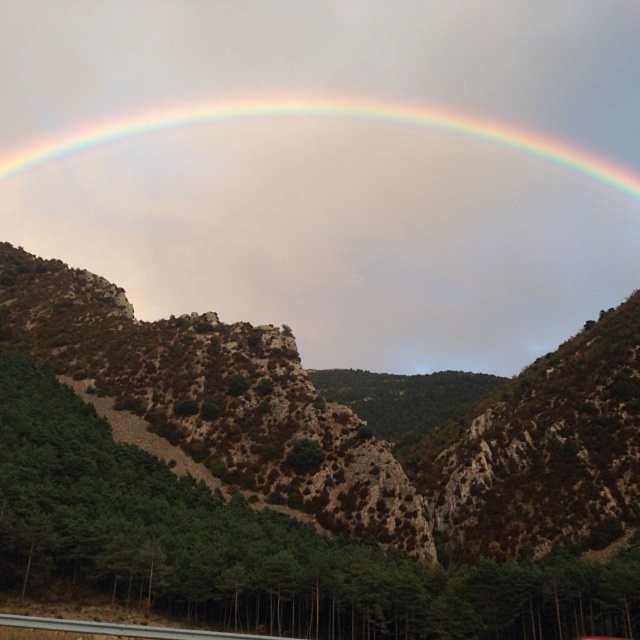
You are a photographer trying to capture the rainbow at upper center and the gray concrete highway at lower center in a single shot. Considering their positions and heights, can you frame the shot so both are visible without moving the camera?

The rainbow at upper center has a greater height compared to the gray concrete highway at lower center, so yes, you can frame the shot to include both as the rainbow is taller and positioned above the highway.

You are an astronomer analyzing the image. You need to determine the position of the rainbow at upper center. What are its coordinates?

The rainbow at upper center is located at coordinates (314, 115).

You are a photographer trying to capture the rainbow at upper center and the gray concrete highway at lower center in a single shot. Given their sizes, which object will appear bigger in the photo?

The rainbow at upper center will appear bigger in the photo because it is larger in size than the gray concrete highway at lower center.